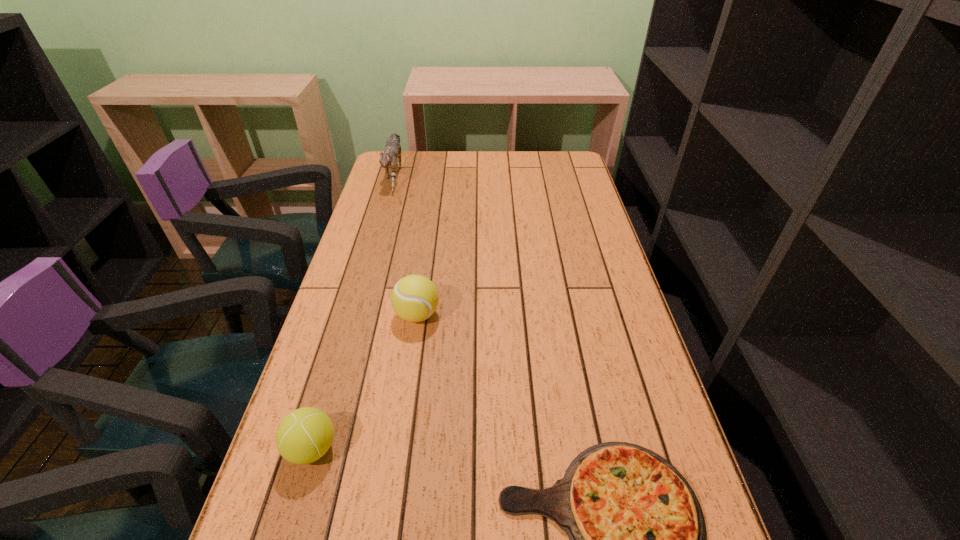
You are a GUI agent. You are given a task and a screenshot of the screen. Output one action in this format:
    pyautogui.click(x=<x>, y=<y>)
    Task: Click on the farthest object
    
    Given the screenshot: What is the action you would take?
    pyautogui.click(x=392, y=150)

Find the location of `cat`. cat is located at coordinates (392, 150).

Locate an element on the screen. Image resolution: width=960 pixels, height=540 pixels. the second farthest object is located at coordinates 414,298.

Image resolution: width=960 pixels, height=540 pixels. I want to click on the right tennis ball, so click(x=414, y=298).

I want to click on the left tennis ball, so click(306, 434).

Where is `the third tallest object`? the third tallest object is located at coordinates (306, 434).

What are the coordinates of `free location located 0.390m on the face of the cat` in the screenshot? It's located at tap(367, 267).

Image resolution: width=960 pixels, height=540 pixels. What are the coordinates of `free space located on the front of the farther tennis ball` in the screenshot? It's located at (412, 355).

Locate an element on the screen. This screenshot has height=540, width=960. vacant area located on the front of the shorter tennis ball is located at coordinates (285, 539).

In order to click on object that is positioned at the far edge in this screenshot , I will do `click(392, 150)`.